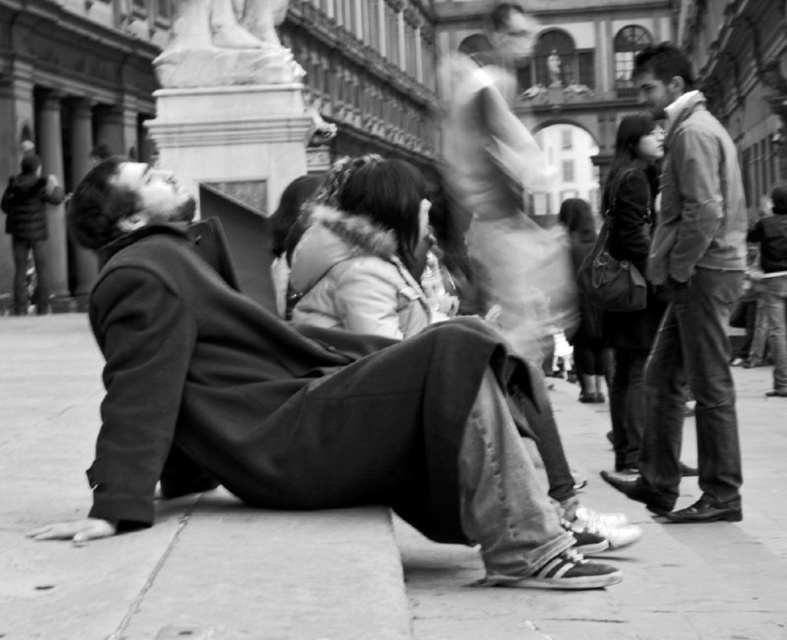
Can you confirm if translucent white robe at center is taller than white fur-lined coat at center?

Indeed, translucent white robe at center has a greater height compared to white fur-lined coat at center.

Is translucent white robe at center above white fur-lined coat at center?

Correct, translucent white robe at center is located above white fur-lined coat at center.

You are a GUI agent. You are given a task and a screenshot of the screen. Output one action in this format:
    pyautogui.click(x=<x>, y=<y>)
    Task: Click on the translucent white robe at center
    This screenshot has width=787, height=640.
    Given the screenshot: What is the action you would take?
    pyautogui.click(x=503, y=205)

The image size is (787, 640). I want to click on translucent white robe at center, so click(x=503, y=205).

Which is below, matte black jacket at right or white marble statue at upper center?

white marble statue at upper center is below.

Is matte black jacket at right below white marble statue at upper center?

Actually, matte black jacket at right is above white marble statue at upper center.

Describe the element at coordinates (632, 189) in the screenshot. I see `matte black jacket at right` at that location.

Where is `matte black jacket at right`? The height and width of the screenshot is (640, 787). matte black jacket at right is located at coordinates (632, 189).

Does matte black coat at lower left have a greater height compared to matte black jacket at right?

No, matte black coat at lower left is not taller than matte black jacket at right.

Consider the image. Which of these two, matte black coat at lower left or matte black jacket at right, stands taller?

matte black jacket at right is taller.

In order to click on matte black coat at lower left in this screenshot , I will do `click(298, 403)`.

The width and height of the screenshot is (787, 640). I want to click on matte black coat at lower left, so click(298, 403).